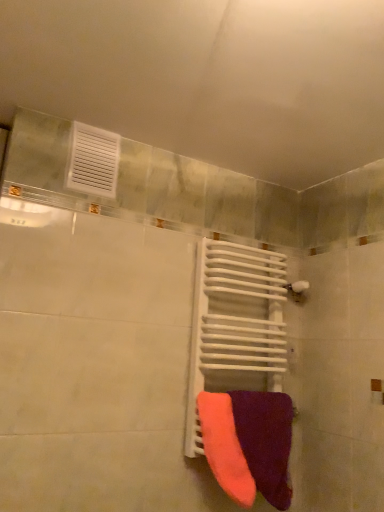
Question: Is velvet purple towel at lower right, which is the 2th towel from left to right, far away from neon orange fabric towel at center, which is the second towel from right to left?

Choices:
 (A) no
 (B) yes

Answer: (A)

Question: Considering the relative sizes of velvet purple towel at lower right, which is the 2th towel from left to right, and neon orange fabric towel at center, which is the second towel from right to left, in the image provided, is velvet purple towel at lower right, which is the 2th towel from left to right, smaller than neon orange fabric towel at center, which is the second towel from right to left,?

Choices:
 (A) no
 (B) yes

Answer: (A)

Question: Does velvet purple towel at lower right, which is the 2th towel from left to right, lie behind neon orange fabric towel at center, which is the second towel from right to left?

Choices:
 (A) yes
 (B) no

Answer: (A)

Question: Is velvet purple towel at lower right, which is the 2th towel from left to right, at the right side of neon orange fabric towel at center, which is the first towel from left to right?

Choices:
 (A) yes
 (B) no

Answer: (A)

Question: Is velvet purple towel at lower right, which is the 2th towel from left to right, facing away from neon orange fabric towel at center, which is the first towel from left to right?

Choices:
 (A) no
 (B) yes

Answer: (A)

Question: From a real-world perspective, is white metallic radiator at center above or below velvet purple towel at lower right, which is the 2th towel from left to right?

Choices:
 (A) below
 (B) above

Answer: (B)

Question: Relative to velvet purple towel at lower right, which is the 2th towel from left to right, is white metallic radiator at center in front or behind?

Choices:
 (A) behind
 (B) front

Answer: (A)

Question: Is white metallic radiator at center inside or outside of velvet purple towel at lower right, arranged as the 1th towel when viewed from the right?

Choices:
 (A) outside
 (B) inside

Answer: (A)

Question: Considering the positions of white metallic radiator at center and velvet purple towel at lower right, which is the 2th towel from left to right, in the image, is white metallic radiator at center wider or thinner than velvet purple towel at lower right, which is the 2th towel from left to right,?

Choices:
 (A) wide
 (B) thin

Answer: (A)

Question: Is neon orange fabric towel at center, which is the first towel from left to right, situated inside white metallic radiator at center or outside?

Choices:
 (A) outside
 (B) inside

Answer: (A)

Question: From a real-world perspective, is neon orange fabric towel at center, which is the first towel from left to right, physically located above or below white metallic radiator at center?

Choices:
 (A) above
 (B) below

Answer: (B)

Question: Considering the relative positions of neon orange fabric towel at center, which is the second towel from right to left, and white metallic radiator at center in the image provided, is neon orange fabric towel at center, which is the second towel from right to left, to the left or to the right of white metallic radiator at center?

Choices:
 (A) left
 (B) right

Answer: (A)

Question: In terms of width, does neon orange fabric towel at center, which is the first towel from left to right, look wider or thinner when compared to white metallic radiator at center?

Choices:
 (A) wide
 (B) thin

Answer: (B)

Question: Is velvet purple towel at lower right, arranged as the 1th towel when viewed from the right, spatially inside neon orange fabric towel at center, which is the second towel from right to left, or outside of it?

Choices:
 (A) outside
 (B) inside

Answer: (A)

Question: From their relative heights in the image, would you say velvet purple towel at lower right, which is the 2th towel from left to right, is taller or shorter than neon orange fabric towel at center, which is the first towel from left to right?

Choices:
 (A) short
 (B) tall

Answer: (B)